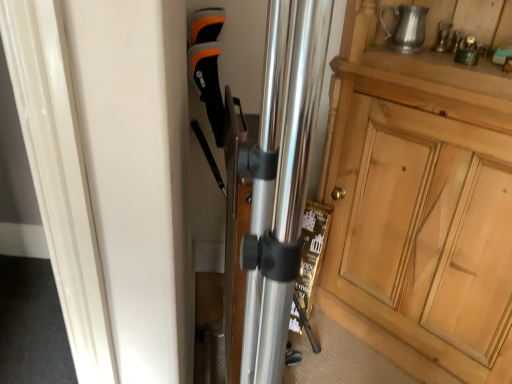
Where is `light brown wooden cupboard at right`? This screenshot has height=384, width=512. light brown wooden cupboard at right is located at coordinates (424, 188).

This screenshot has height=384, width=512. What do you see at coordinates (424, 188) in the screenshot? I see `light brown wooden cupboard at right` at bounding box center [424, 188].

You are a GUI agent. You are given a task and a screenshot of the screen. Output one action in this format:
    pyautogui.click(x=<x>, y=<y>)
    Task: Click on the light brown wooden cupboard at right
    The width and height of the screenshot is (512, 384).
    Given the screenshot: What is the action you would take?
    pyautogui.click(x=424, y=188)